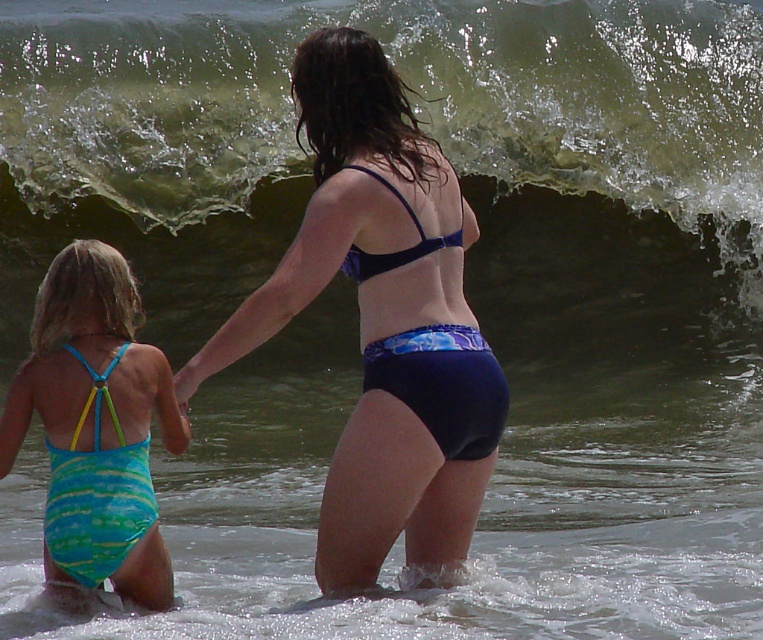
You are a lifeguard on duty and need to ensure all swimmers are wearing appropriate swimwear. According to the beach regulations, swimwear must not exceed 30cm in width. Can you confirm if the blue striped swimsuit at lower left and the blue matte bikini bottom at center comply with the size requirement?

The blue striped swimsuit at lower left is bigger than the blue matte bikini bottom at center. Since the regulation states swimwear must not exceed 30cm in width, the blue striped swimsuit at lower left may be too large and could violate the regulation, while the blue matte bikini bottom at center is likely compliant.

You are standing at the point marked as point (382, 320) in the image. Looking around, you see the blue fabric bikini at center. What is directly under your feet?

The point (382, 320) corresponds to the blue fabric bikini at center, so the blue fabric bikini at center is directly under your feet.

You are a photographer trying to capture a photo of the blue fabric bikini at center and the blue striped swimsuit at lower left. Which one is closer to the camera?

The blue fabric bikini at center is closer to the camera because it is in front of the blue striped swimsuit at lower left.